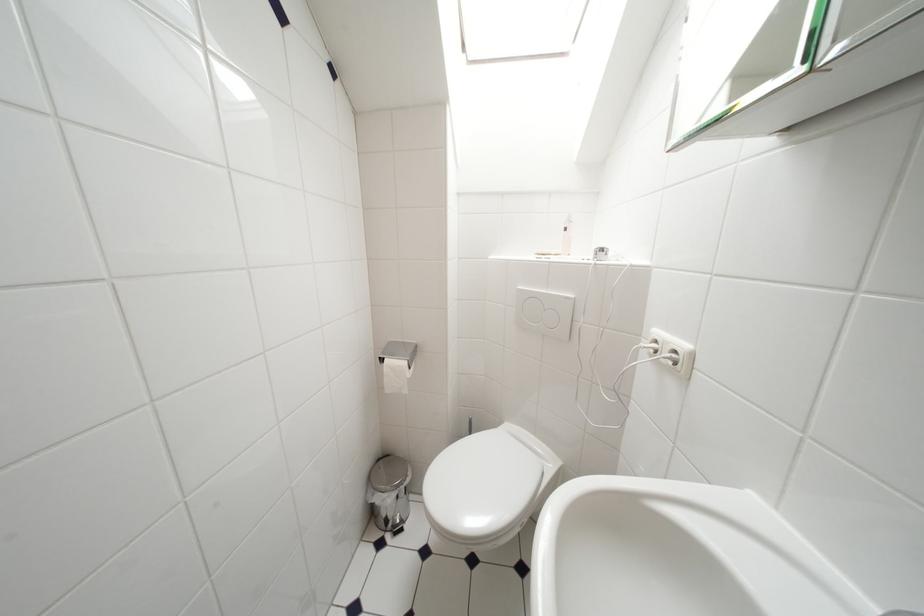
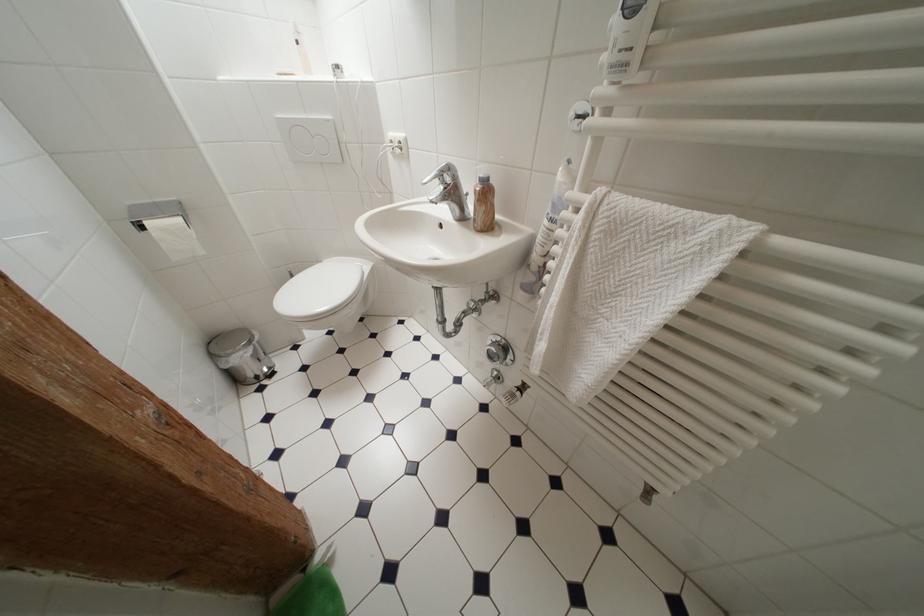
Where in the second image is the point corresponding to the point at 399,359 from the first image?

(160, 219)